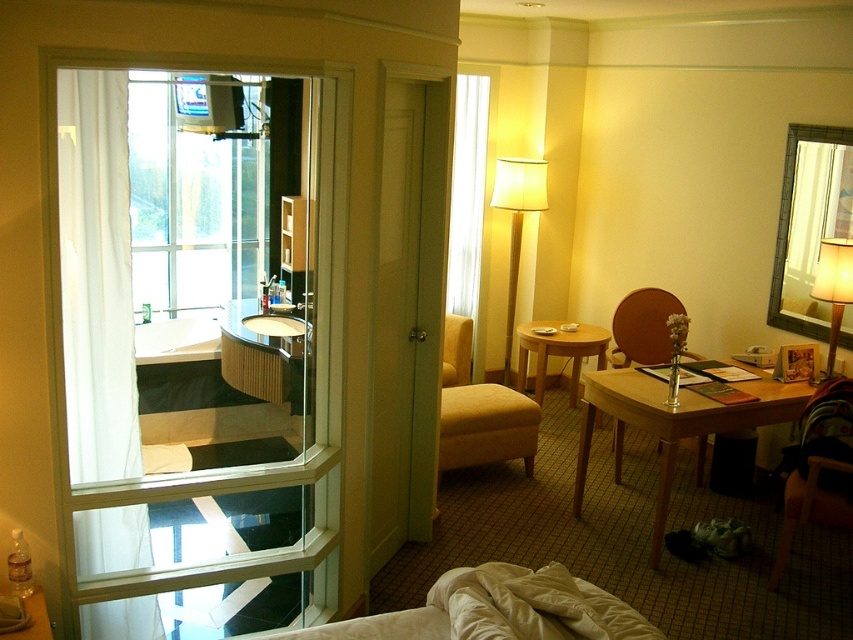
You are standing in the hotel room and want to look outside through the clear glass window at upper left. However, there is a brown fabric armchair at lower right in the way. Can you see through the window without moving the armchair?

The clear glass window at upper left is further to the viewer than brown fabric armchair at lower right, so the armchair is between you and the window. Therefore, you cannot see through the window without moving the armchair.